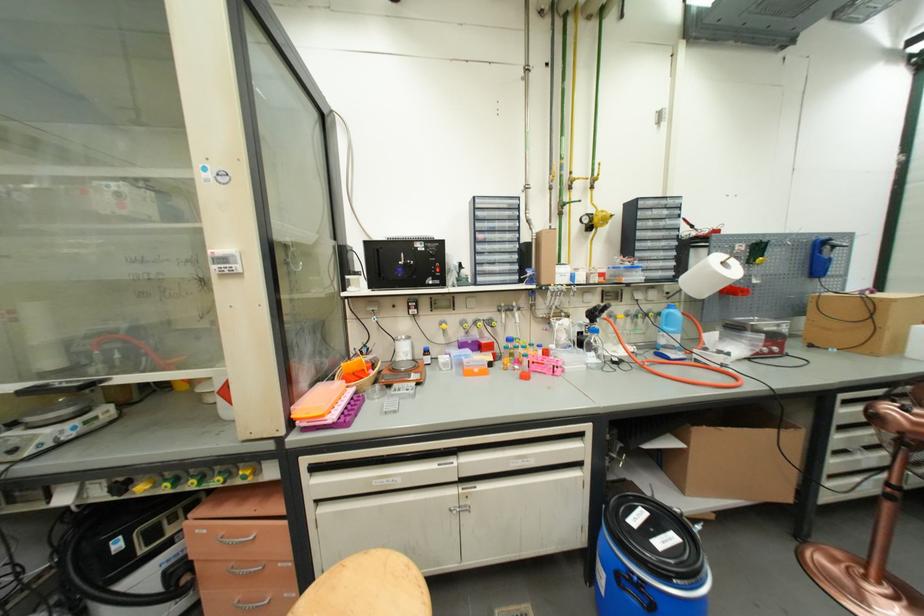
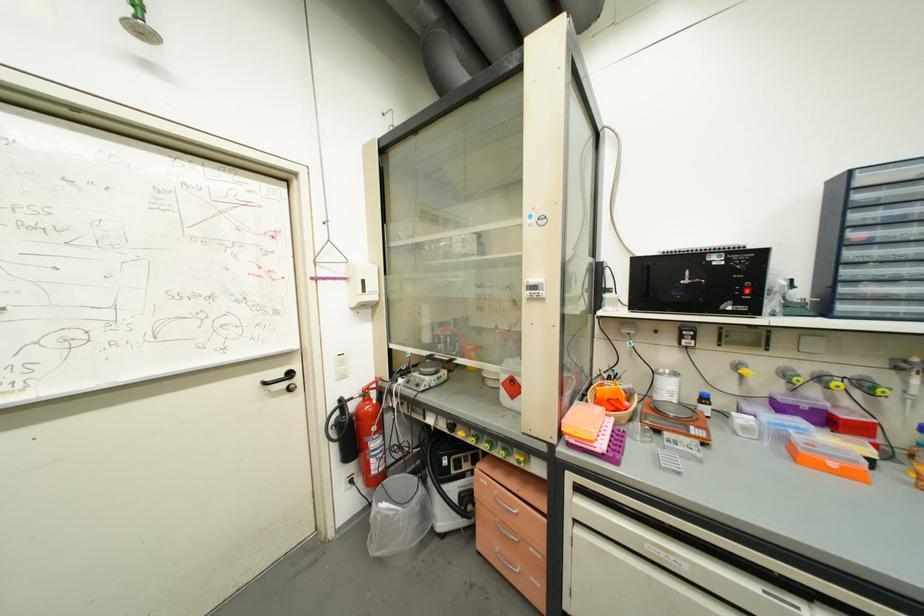
The point at [505,310] is marked in the first image. Where is the corresponding point in the second image?

(909, 367)